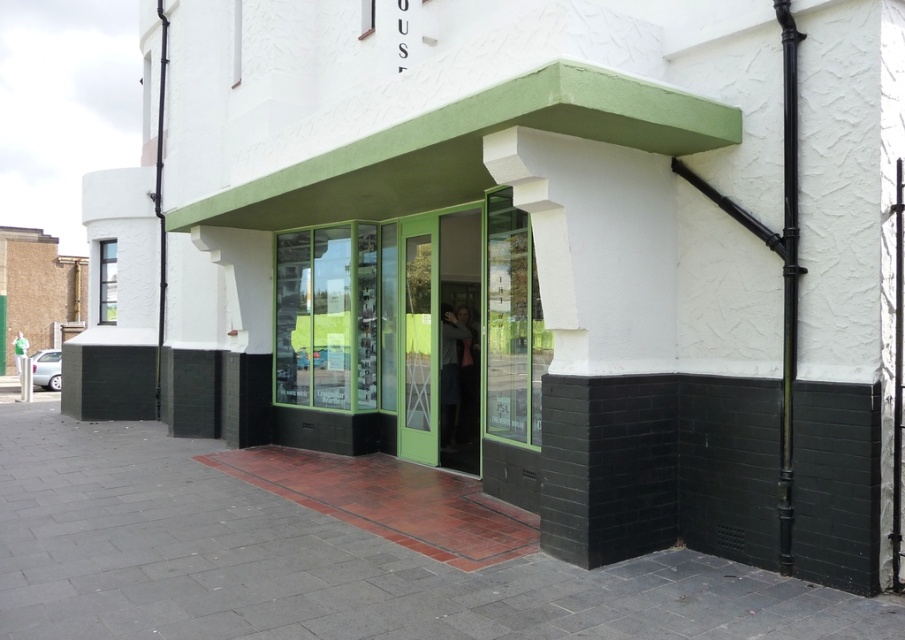
You are a delivery person approaching the building and need to locate the entrance. According to the scene, which object is positioned above the other between the green glass door at center and the white smooth pillar at center?

The white smooth pillar at center is positioned above the green glass door at center because the green glass door at center is located below it.

You are standing in front of the building and want to walk towards the entrance. Which object, the smooth brick pavement at center or the white smooth pillar at center, will you encounter first?

The smooth brick pavement at center is closer to the viewer than the white smooth pillar at center, so you will encounter the smooth brick pavement at center first.